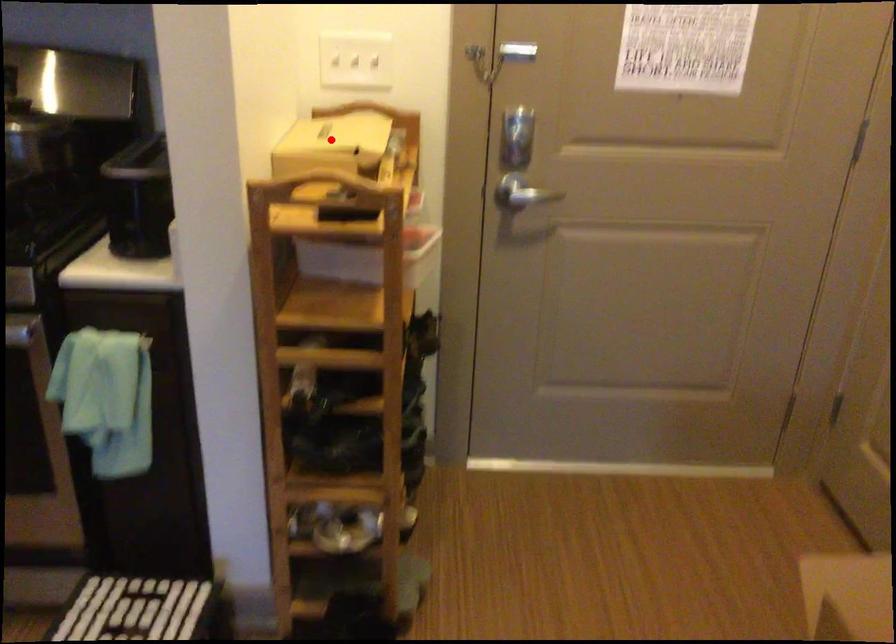
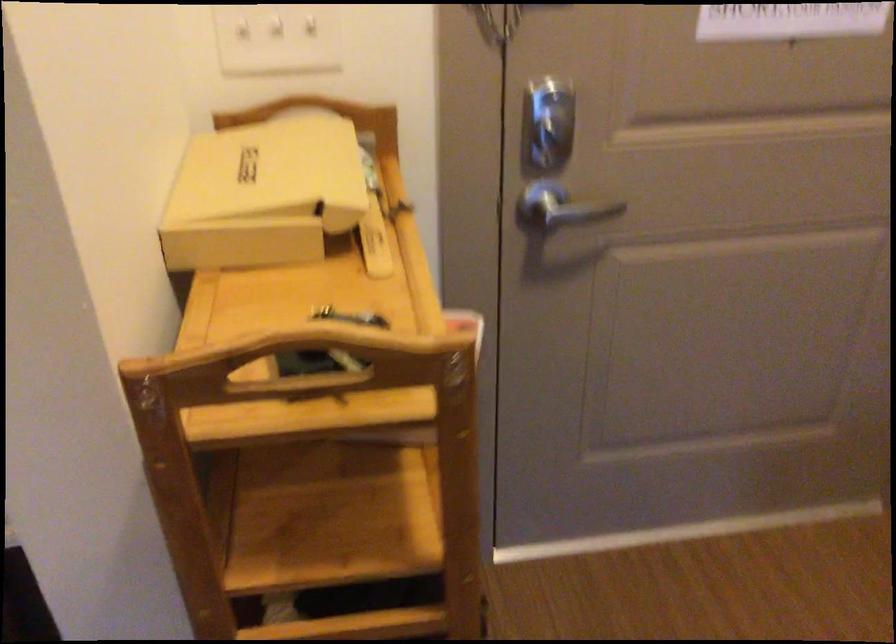
Question: A red point is marked in image1. In image2, is the corresponding 3D point closer to the camera or farther? Reply with the corresponding letter.

Choices:
 (A) The corresponding 3D point is closer.
 (B) The corresponding 3D point is farther.

Answer: (A)